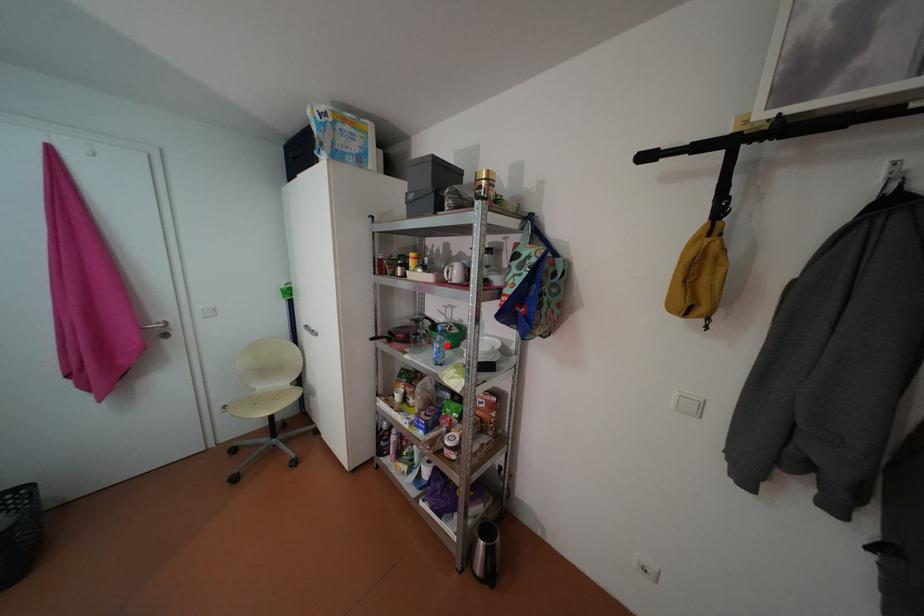
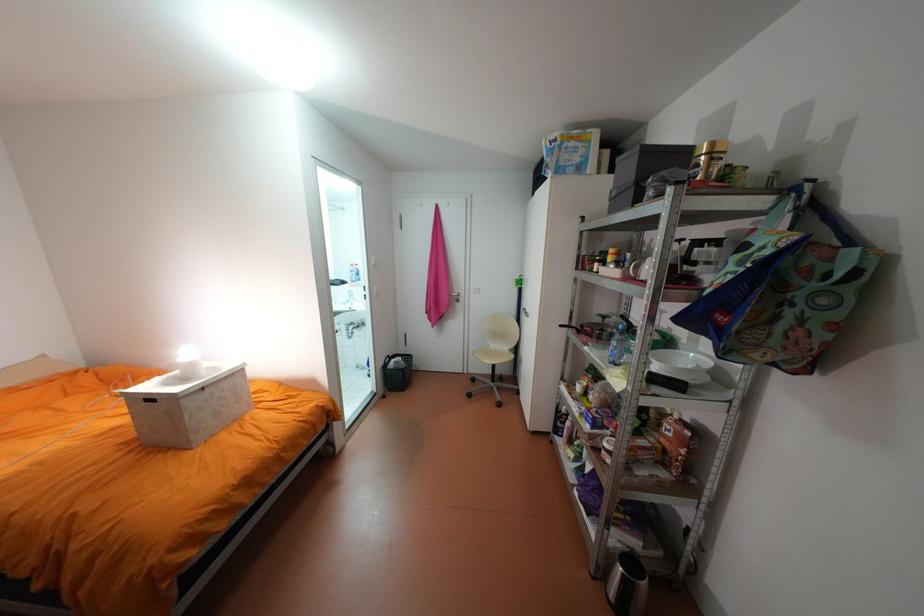
Question: I am providing you with two images of the same scene from different viewpoints. A red point is marked on the first image. At the location where the point appears in image 1, is it still visible in image 2?

Choices:
 (A) Yes
 (B) No

Answer: (A)